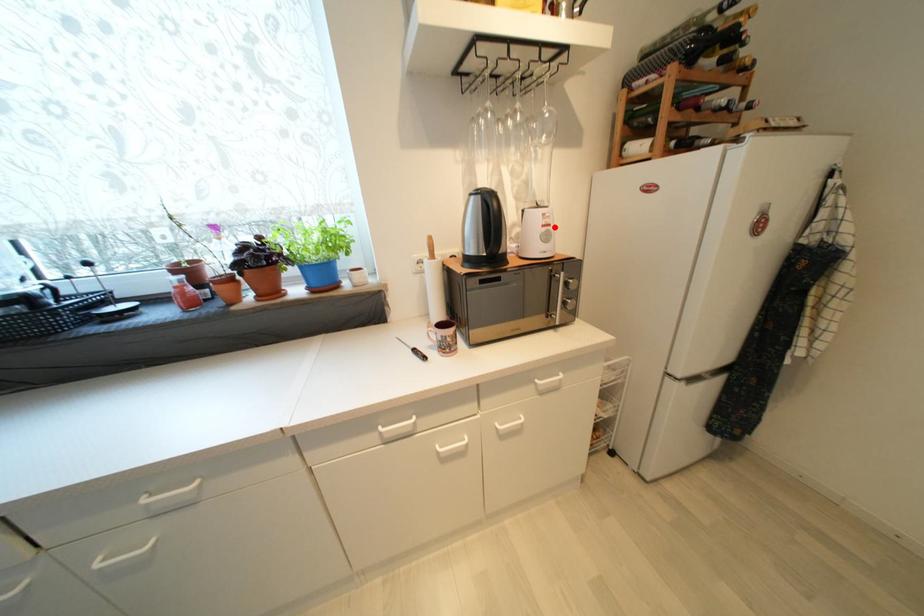
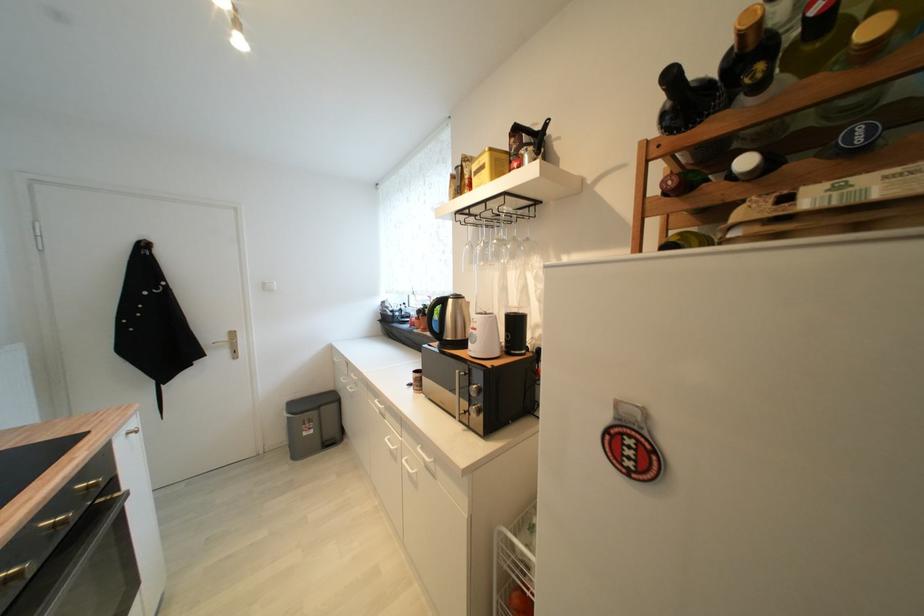
Where in the second image is the point corresponding to the highlighted location from the first image?

(480, 331)